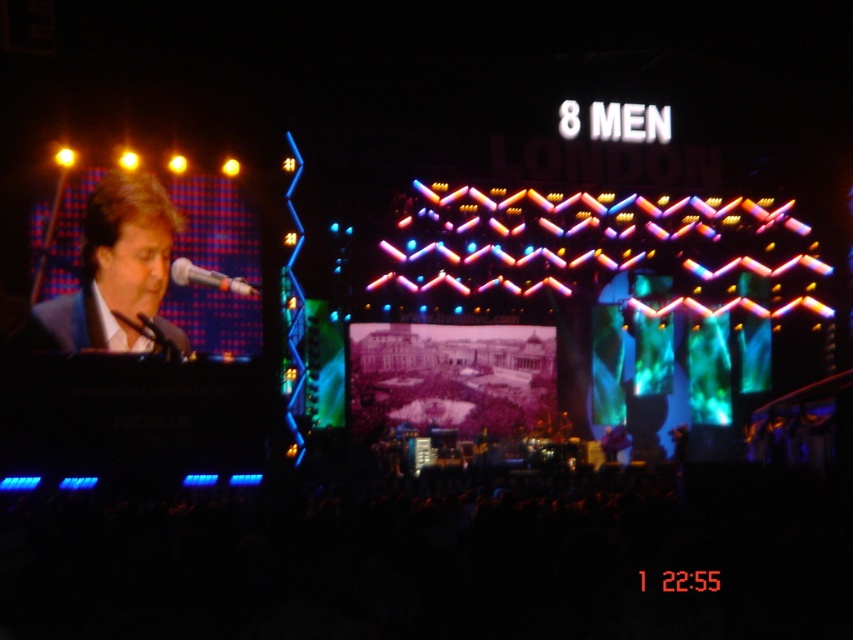
You are a photographer at the concert venue. You need to capture a clear photo of both the matte black suit at left and the white glossy microphone at left. Given their sizes, which object should you focus on first to ensure both are in frame?

The matte black suit at left is larger in size than the white glossy microphone at left, so you should focus on the matte black suit at left first to ensure both fit within the frame.

You are a photographer positioned at the front of the stage. You want to capture a closeup shot of the matte black suit at left without moving your position. Is it possible to do so with your current camera lens that has a maximum zoom of 100 meters?

The matte black suit at left is 95.23 meters from viewer. Since your camera lens can zoom up to 100 meters, you can capture a closeup shot of the matte black suit at left without moving your position.

You are a photographer positioned at the front of the stage. You need to take a clear photo of both the matte black suit at left and the white glossy microphone at left. Which object will appear larger in your photo?

The matte black suit at left will appear larger in the photo because it is closer to the viewer than the white glossy microphone at left.